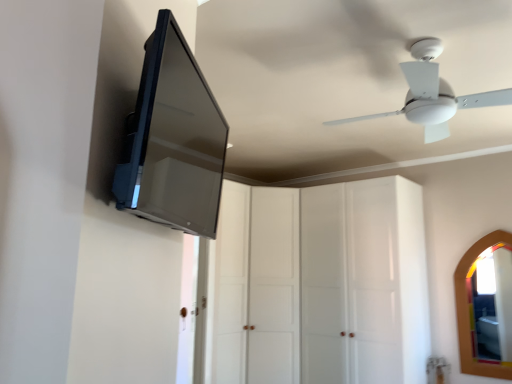
Question: Considering the relative sizes of white glossy cabinet at center, marked as the 1th glass door in a right-to-left arrangement, and satin black tv at upper left in the image provided, is white glossy cabinet at center, marked as the 1th glass door in a right-to-left arrangement, wider than satin black tv at upper left?

Choices:
 (A) yes
 (B) no

Answer: (A)

Question: From the image's perspective, is white glossy cabinet at center, marked as the 1th glass door in a right-to-left arrangement, below satin black tv at upper left?

Choices:
 (A) no
 (B) yes

Answer: (B)

Question: Is white glossy cabinet at center, marked as the 1th glass door in a right-to-left arrangement, located outside satin black tv at upper left?

Choices:
 (A) no
 (B) yes

Answer: (B)

Question: From a real-world perspective, is white glossy cabinet at center, marked as the 2th glass door in a left-to-right arrangement, located higher than satin black tv at upper left?

Choices:
 (A) yes
 (B) no

Answer: (B)

Question: Is white glossy cabinet at center, marked as the 1th glass door in a right-to-left arrangement, looking in the opposite direction of satin black tv at upper left?

Choices:
 (A) no
 (B) yes

Answer: (A)

Question: Can you confirm if white glossy cabinet at center, marked as the 1th glass door in a right-to-left arrangement, is taller than satin black tv at upper left?

Choices:
 (A) yes
 (B) no

Answer: (A)

Question: From the image's perspective, is satin black tv at upper left located beneath white plastic ceiling fan at upper right?

Choices:
 (A) no
 (B) yes

Answer: (B)

Question: Does satin black tv at upper left have a larger size compared to white plastic ceiling fan at upper right?

Choices:
 (A) yes
 (B) no

Answer: (B)

Question: Does satin black tv at upper left have a lesser width compared to white plastic ceiling fan at upper right?

Choices:
 (A) no
 (B) yes

Answer: (B)

Question: Considering the relative positions of satin black tv at upper left and white plastic ceiling fan at upper right in the image provided, is satin black tv at upper left to the left of white plastic ceiling fan at upper right from the viewer's perspective?

Choices:
 (A) no
 (B) yes

Answer: (B)

Question: Considering the relative positions of satin black tv at upper left and white plastic ceiling fan at upper right in the image provided, is satin black tv at upper left behind white plastic ceiling fan at upper right?

Choices:
 (A) no
 (B) yes

Answer: (A)

Question: Are satin black tv at upper left and white plastic ceiling fan at upper right located far from each other?

Choices:
 (A) yes
 (B) no

Answer: (A)

Question: Would you say satin black tv at upper left contains transparent glass cabinet at center, arranged as the 2th glass door when viewed from the right?

Choices:
 (A) yes
 (B) no

Answer: (B)